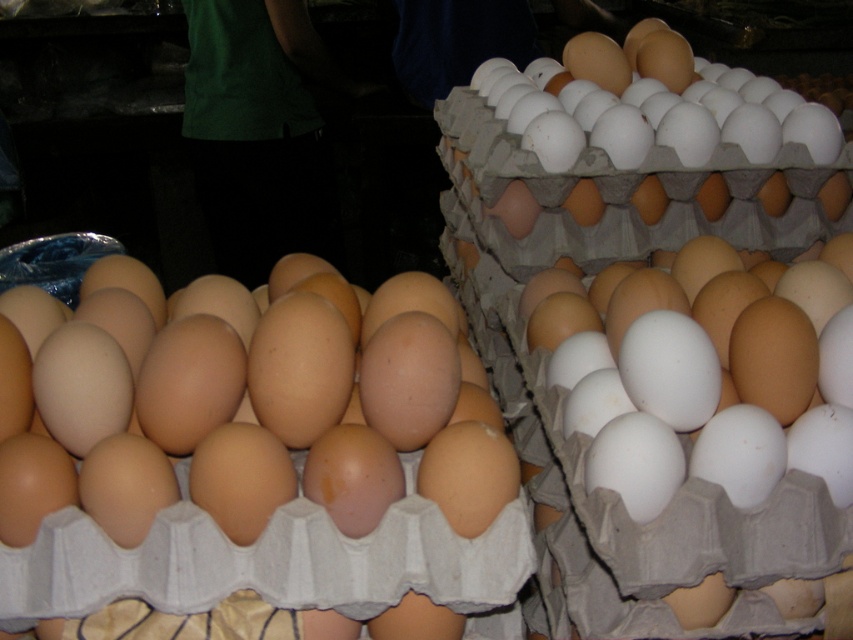
Does point (428, 326) come behind point (717, 128)?

That is False.

Measure the distance between brown matte egg at center and camera.

They are 31.67 inches apart.

Describe the element at coordinates (251, 413) in the screenshot. I see `brown matte egg at center` at that location.

Where is `brown matte egg at center`? The image size is (853, 640). brown matte egg at center is located at coordinates (251, 413).

Describe the element at coordinates (251, 413) in the screenshot. The height and width of the screenshot is (640, 853). I see `brown matte egg at center` at that location.

Is brown matte egg at center to the left of white matte egg at center from the viewer's perspective?

Correct, you'll find brown matte egg at center to the left of white matte egg at center.

This screenshot has width=853, height=640. What do you see at coordinates (251, 413) in the screenshot?
I see `brown matte egg at center` at bounding box center [251, 413].

Locate an element on the screen. The height and width of the screenshot is (640, 853). brown matte egg at center is located at coordinates (251, 413).

Who is shorter, white matte egg at center or white matte egg at upper right?

white matte egg at center

Does white matte egg at center have a larger size compared to white matte egg at upper right?

Actually, white matte egg at center might be smaller than white matte egg at upper right.

Which is behind, point (833, 429) or point (776, 129)?

The point (776, 129) is behind.

The height and width of the screenshot is (640, 853). I want to click on white matte egg at center, so click(x=708, y=376).